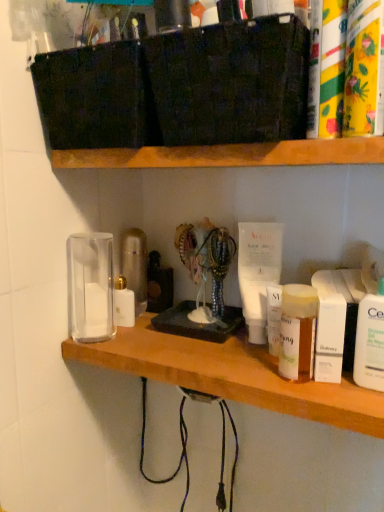
Image resolution: width=384 pixels, height=512 pixels. What are the coordinates of `space that is in front of white glossy lotion at left, the 6th toiletry when ordered from right to left` in the screenshot? It's located at (146, 341).